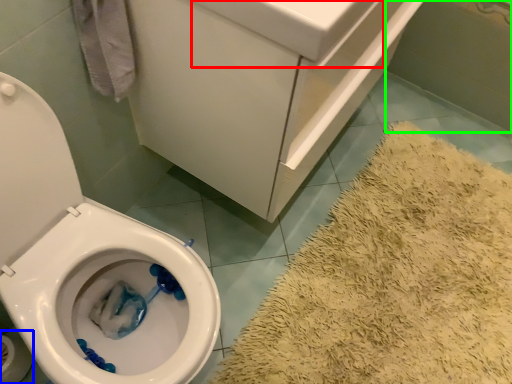
Question: Which object is the closest to the sink (highlighted by a red box)? Choose among these: toilet paper (highlighted by a blue box) or bath (highlighted by a green box).

Choices:
 (A) toilet paper
 (B) bath

Answer: (A)